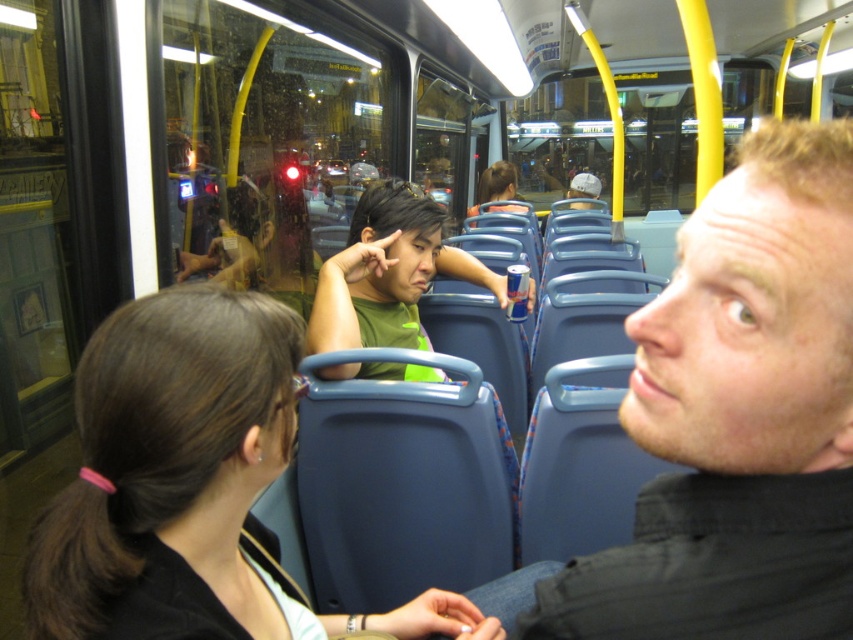
Question: Observing the image, what is the correct spatial positioning of smooth black shirt at center in reference to matte green shirt at center?

Choices:
 (A) left
 (B) right

Answer: (A)

Question: Which object appears farthest from the camera in this image?

Choices:
 (A) brown hair at center
 (B) smooth black shirt at center
 (C) matte green shirt at center

Answer: (C)

Question: Is smooth black shirt at center positioned before brown hair at center?

Choices:
 (A) yes
 (B) no

Answer: (A)

Question: In this image, where is green matte shirt at center located relative to matte green shirt at center?

Choices:
 (A) right
 (B) left

Answer: (B)

Question: Which point is closer to the camera?

Choices:
 (A) (381, 284)
 (B) (767, 417)

Answer: (B)

Question: Considering the real-world distances, which object is farthest from the matte green shirt at center?

Choices:
 (A) brown hair at center
 (B) smooth black shirt at center
 (C) green matte shirt at center

Answer: (B)